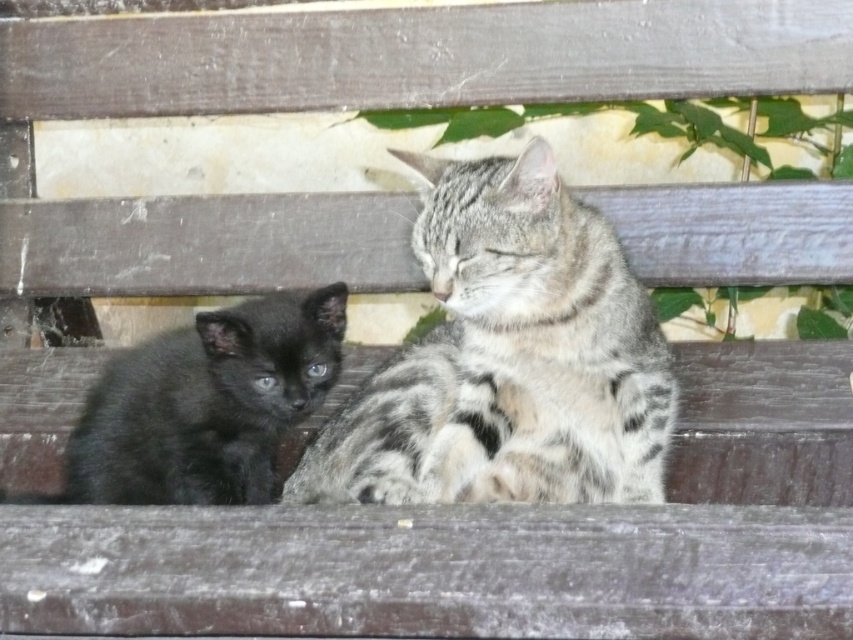
You are a photographer setting up a camera to take a portrait of both the gray striped cat at center and the black fur kitten at left. You want to ensure both cats are fully in frame without any part of them being cut off. Given that your camera has a fixed focal length, which cat requires more space horizontally to be fully captured?

The gray striped cat at center requires more horizontal space because its width surpasses that of the black fur kitten at left.

You are a photographer trying to capture both cats on the wooden bench. The gray striped cat at center is located at point (508, 358). Where should you position your camera to ensure both cats are in frame?

To ensure both cats are in frame, position your camera so that the gray striped cat at center is centered at point (508, 358). This central positioning will allow the black kitten on the left and the gray striped cat at center to be captured together.

You are a photographer trying to capture a clear photo of the gray striped cat at center. However, the black fur kitten at left is blocking part of the view. Can you adjust your position to take a photo without the kitten in the frame?

The gray striped cat at center is in front of the black fur kitten at left, so adjusting your position slightly to the right or left might allow you to frame the shot so the gray striped cat at center is visible without the black fur kitten at left blocking the view.